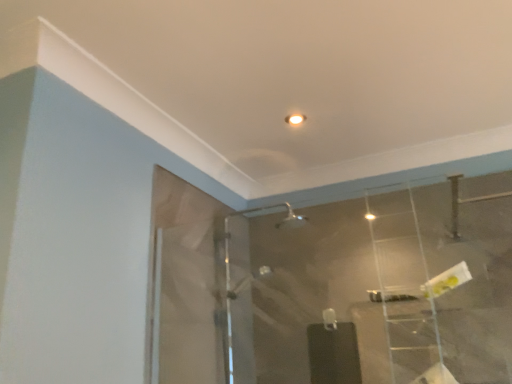
Question: Considering the relative sizes of clear plastic ladder at upper right and transparent glass mirror at center in the image provided, is clear plastic ladder at upper right bigger than transparent glass mirror at center?

Choices:
 (A) yes
 (B) no

Answer: (A)

Question: Could transparent glass mirror at center be considered to be inside clear plastic ladder at upper right?

Choices:
 (A) yes
 (B) no

Answer: (B)

Question: Is clear plastic ladder at upper right thinner than transparent glass mirror at center?

Choices:
 (A) no
 (B) yes

Answer: (A)

Question: Is clear plastic ladder at upper right to the right of transparent glass mirror at center from the viewer's perspective?

Choices:
 (A) yes
 (B) no

Answer: (A)

Question: From a real-world perspective, is clear plastic ladder at upper right positioned over transparent glass mirror at center based on gravity?

Choices:
 (A) no
 (B) yes

Answer: (B)

Question: Is the position of clear plastic ladder at upper right less distant than that of transparent glass mirror at center?

Choices:
 (A) no
 (B) yes

Answer: (A)

Question: Is transparent glass mirror at center turned away from clear plastic ladder at upper right?

Choices:
 (A) no
 (B) yes

Answer: (B)

Question: From a real-world perspective, is transparent glass mirror at center positioned under clear plastic ladder at upper right based on gravity?

Choices:
 (A) no
 (B) yes

Answer: (B)

Question: Does transparent glass mirror at center have a larger size compared to clear plastic ladder at upper right?

Choices:
 (A) yes
 (B) no

Answer: (B)

Question: From a real-world perspective, is transparent glass mirror at center over clear plastic ladder at upper right?

Choices:
 (A) yes
 (B) no

Answer: (B)

Question: Can clear plastic ladder at upper right be found inside transparent glass mirror at center?

Choices:
 (A) no
 (B) yes

Answer: (A)

Question: Is there a large distance between transparent glass mirror at center and clear plastic ladder at upper right?

Choices:
 (A) no
 (B) yes

Answer: (A)

Question: Is clear plastic ladder at upper right bigger or smaller than transparent glass mirror at center?

Choices:
 (A) small
 (B) big

Answer: (B)